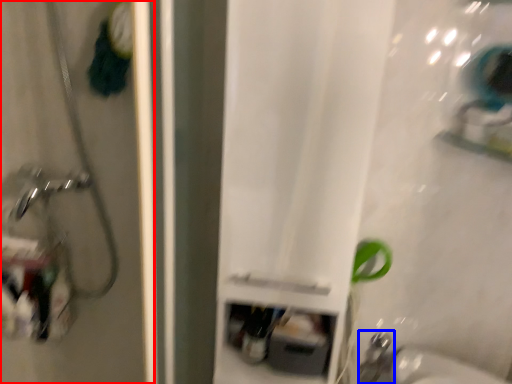
Question: Which object appears farthest to the camera in this image, screen door (highlighted by a red box) or faucet (highlighted by a blue box)?

Choices:
 (A) screen door
 (B) faucet

Answer: (B)